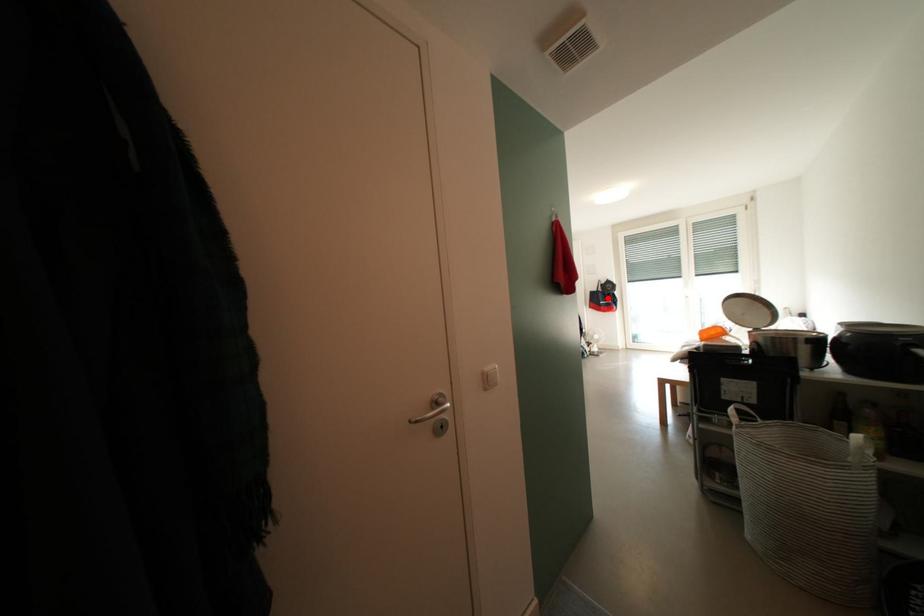
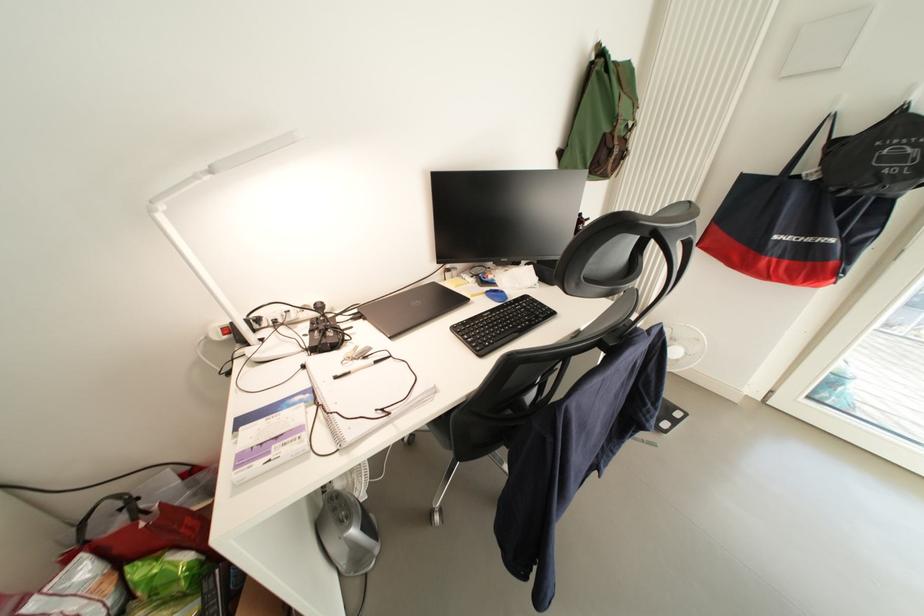
The point at the highlighted location is marked in the first image. Where is the corresponding point in the second image?

(801, 203)